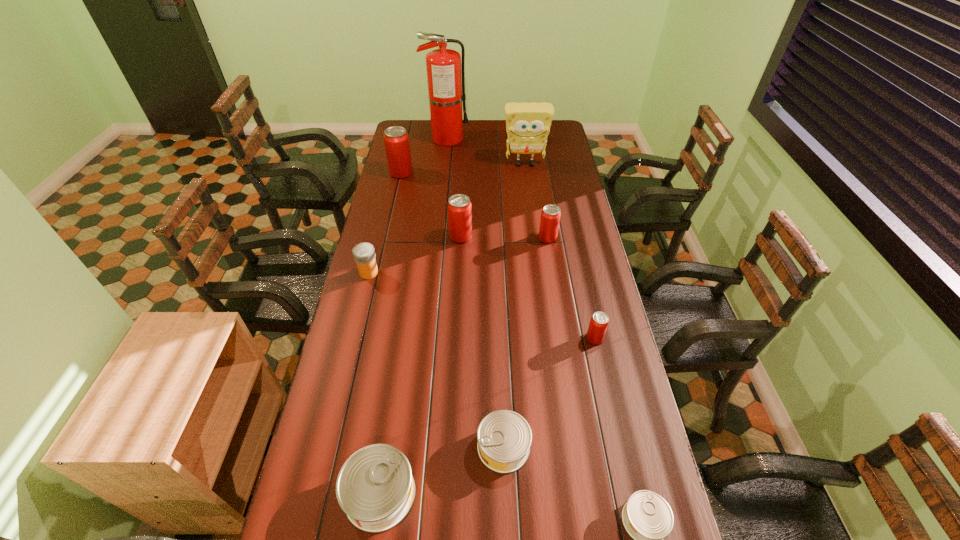
Image resolution: width=960 pixels, height=540 pixels. I want to click on blank space located 0.380m on the left of the third red can from left to right, so pos(445,238).

Locate an element on the screen. vacant space located 0.340m on the label side of the medicine is located at coordinates 469,273.

Locate an element on the screen. free space located on the back of the nearest red can is located at coordinates (587, 300).

Locate an element on the screen. This screenshot has width=960, height=540. vacant area situated on the back of the leftmost silver can is located at coordinates (397, 373).

The width and height of the screenshot is (960, 540). I want to click on blank space located on the right of the sixth tallest can, so click(x=578, y=447).

What are the coordinates of `object that is at the far edge` in the screenshot? It's located at (446, 89).

Identify the location of fire extinguisher at the left edge. (446, 89).

Locate an element on the screen. The width and height of the screenshot is (960, 540). medicine located in the left edge section of the desktop is located at coordinates (364, 254).

Where is `sponge that is at the right edge`? The width and height of the screenshot is (960, 540). sponge that is at the right edge is located at coordinates (528, 125).

Find the location of `object present at the far left corner`. object present at the far left corner is located at coordinates (446, 89).